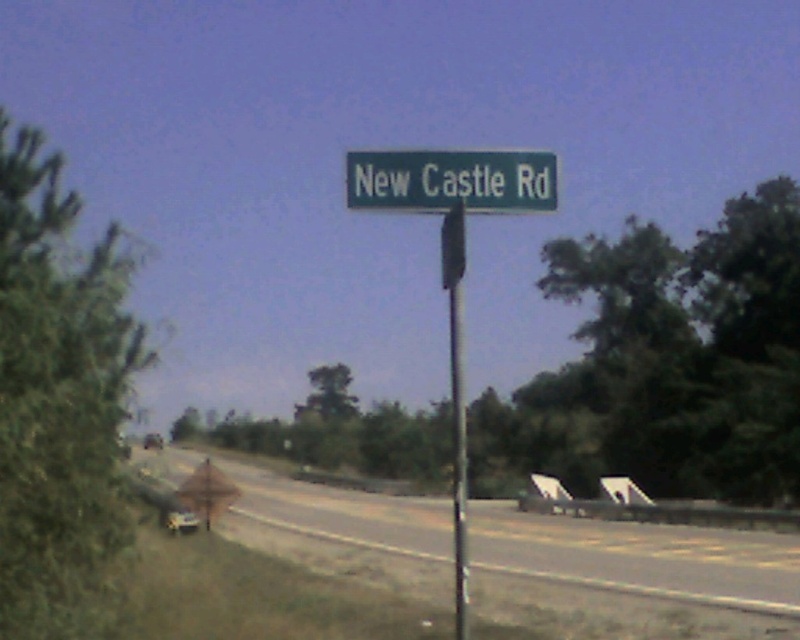
Is green metallic street sign at center closer to the viewer compared to metallic pole at center?

No, it is behind metallic pole at center.

Which is below, green metallic street sign at center or metallic pole at center?

Positioned lower is metallic pole at center.

You are a GUI agent. You are given a task and a screenshot of the screen. Output one action in this format:
    pyautogui.click(x=<x>, y=<y>)
    Task: Click on the green metallic street sign at center
    
    Given the screenshot: What is the action you would take?
    pyautogui.click(x=450, y=180)

Identify the location of green metallic street sign at center. click(x=450, y=180).

Between gray asphalt highway at center and metallic silver car at center, which one is positioned higher?

Positioned higher is metallic silver car at center.

Between point (510, 516) and point (180, 509), which one is positioned in front?

Point (180, 509)

Image resolution: width=800 pixels, height=640 pixels. I want to click on gray asphalt highway at center, so 641,557.

Does gray asphalt highway at center have a lesser height compared to green metallic street sign at center?

Incorrect, gray asphalt highway at center's height does not fall short of green metallic street sign at center's.

Consider the image. Can you confirm if gray asphalt highway at center is smaller than green metallic street sign at center?

Actually, gray asphalt highway at center might be larger than green metallic street sign at center.

Does point (790, 588) lie behind point (384, 204)?

Yes, it is.

Image resolution: width=800 pixels, height=640 pixels. I want to click on gray asphalt highway at center, so click(641, 557).